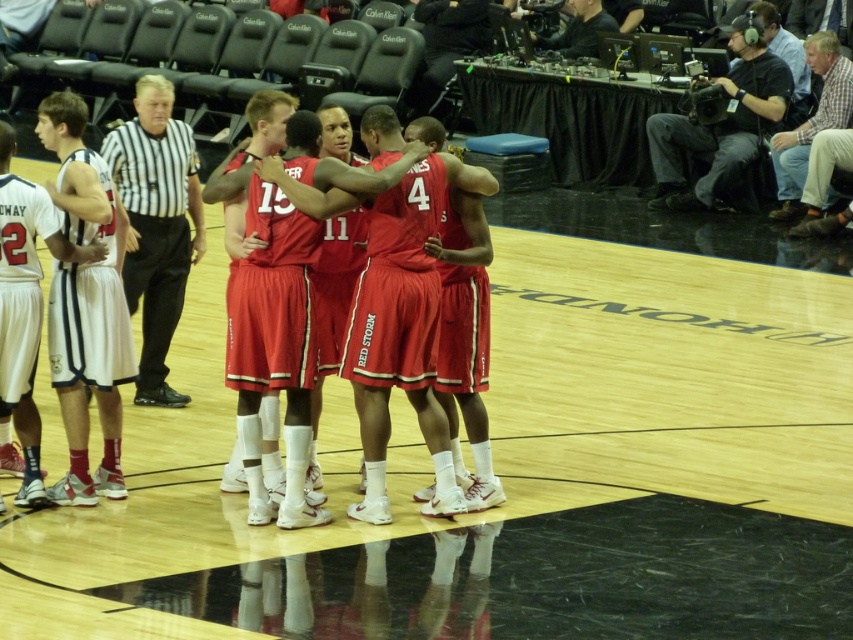
Who is shorter, black striped shirt at left or black striped shirt at upper left?

black striped shirt at left

Is black striped shirt at left positioned before black striped shirt at upper left?

That is True.

Is point (177, 225) positioned behind point (647, 120)?

No.

Locate an element on the screen. black striped shirt at left is located at coordinates (155, 225).

Consider the image. Is shiny red jersey at center to the left of white matte basketball guard at left from the viewer's perspective?

Incorrect, shiny red jersey at center is not on the left side of white matte basketball guard at left.

The width and height of the screenshot is (853, 640). I want to click on shiny red jersey at center, so click(277, 353).

Who is positioned more to the left, white matte basketball guard at left or plaid shirt at upper right?

white matte basketball guard at left is more to the left.

Can you confirm if white matte basketball guard at left is thinner than plaid shirt at upper right?

Correct, white matte basketball guard at left's width is less than plaid shirt at upper right's.

Between point (90, 164) and point (837, 49), which one is positioned behind?

Positioned behind is point (837, 49).

The image size is (853, 640). I want to click on white matte basketball guard at left, so click(85, 305).